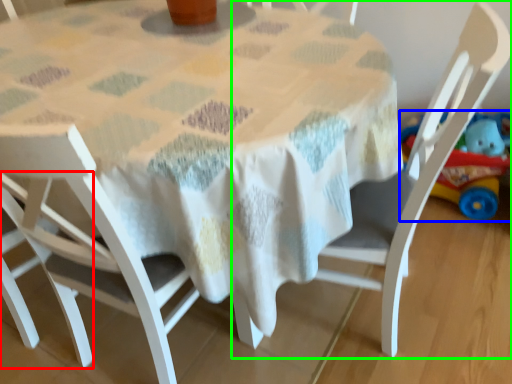
Question: Considering the real-world distances, which object is closest to chair (highlighted by a red box)? toy (highlighted by a blue box) or chair (highlighted by a green box).

Choices:
 (A) toy
 (B) chair

Answer: (B)